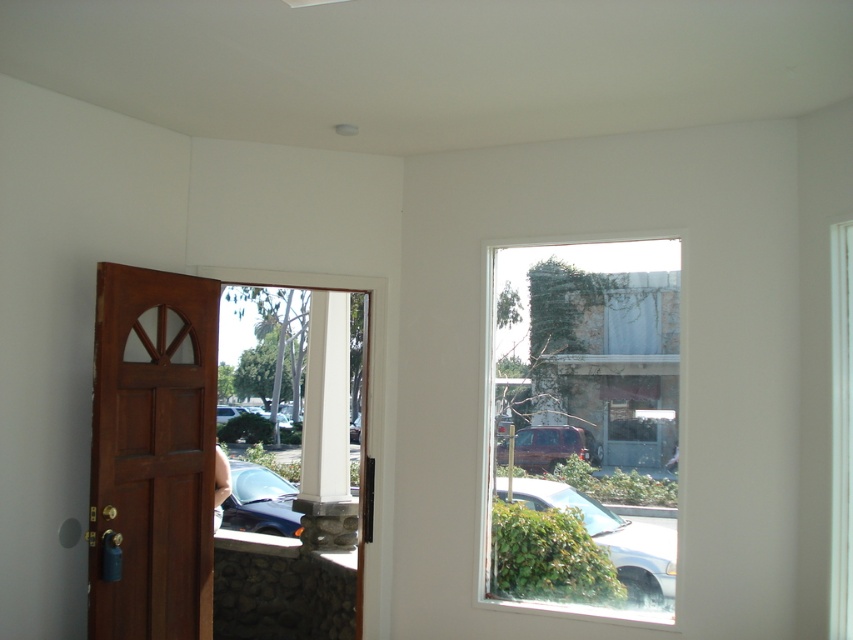
You are standing in the room depicted in the image. There is a point marked at coordinates (592, 392). Based on the scene description, what object or feature is located at that point?

The point at coordinates (592, 392) corresponds to the stone textured wall at upper right.

You are standing in the room and want to exit through the brown wooden door at left. However, there is a matte red suv at center blocking the doorway. Can you exit through the door without moving the suv?

The brown wooden door at left has a lesser width compared to matte red suv at center. Since the door is narrower than the suv, the suv cannot block the doorway completely. Therefore, you can exit through the door without moving the suv.